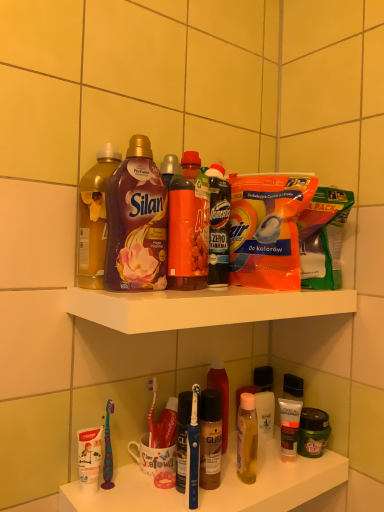
The height and width of the screenshot is (512, 384). In order to click on vacant area located to the right-hand side of purple glossy liquid at upper center, the first bottle viewed from the front in this screenshot , I will do `click(196, 290)`.